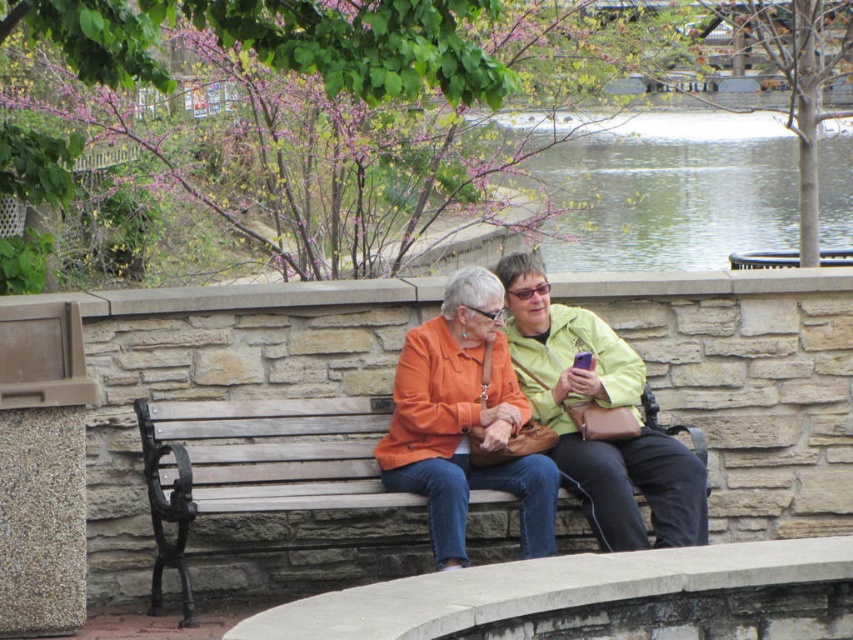
You are a painter standing at the edge of this outdoor scene. You want to paint the wooden bench at center and the matte orange jacket at center. Which object should you focus on first if you want to paint the larger one first?

The wooden bench at center has a larger size compared to the matte orange jacket at center, so you should focus on painting the wooden bench at center first.

Based on the photo, you are a photographer trying to capture a candid shot of the matte orange jacket at center without including the wooden bench at center in the frame. Is this possible given their positions?

The wooden bench at center is in front of the matte orange jacket at center, so it would block the view. Therefore, you cannot capture the matte orange jacket at center without the wooden bench at center in the frame.